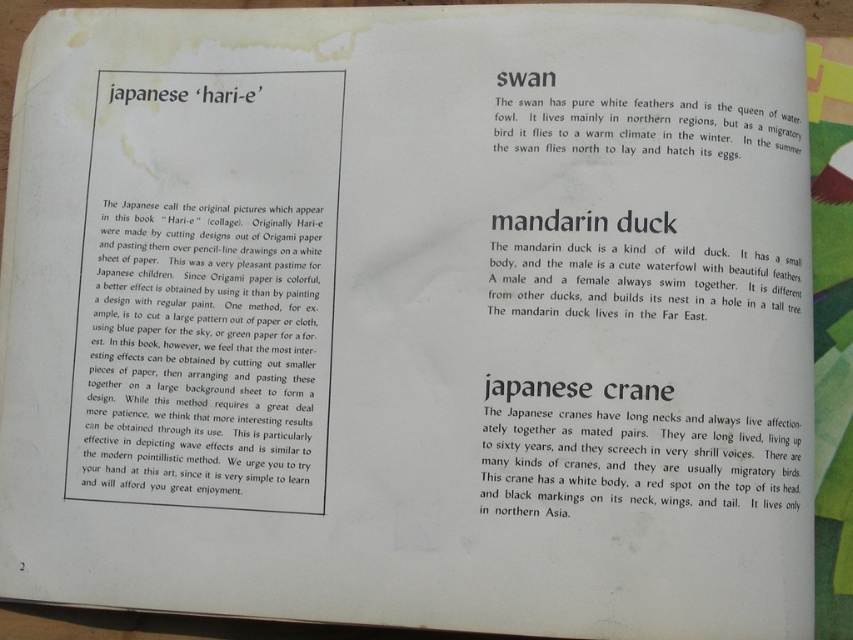
You are an artist looking at this book page. You notice the white paper at upper left and the white feathered swan at upper right. According to the book, which object is positioned lower on the page?

The white paper at upper left is located below the white feathered swan at upper right, so the white paper at upper left is positioned lower on the page.

You are an artist trying to create a Hari_e artwork. You have a white paper at upper left and a white feathered swan at upper right. Which object has a smaller width?

The white paper at upper left has a smaller width than the white feathered swan at upper right according to the description.